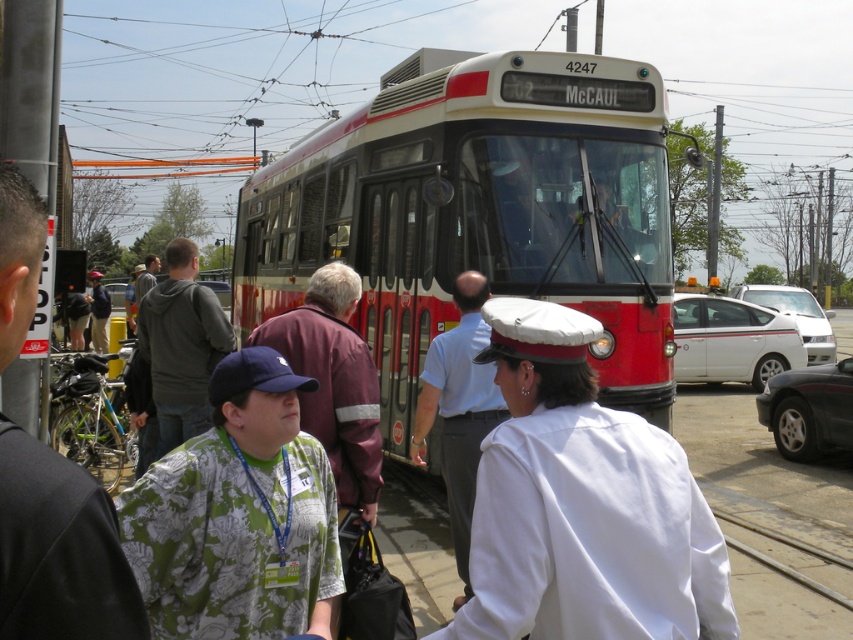
Which is more to the left, white uniform at center or dark gray hoodie at center?

From the viewer's perspective, dark gray hoodie at center appears more on the left side.

Between point (473, 310) and point (200, 401), which one is positioned in front?

Point (473, 310) is in front.

Between point (453, 394) and point (207, 291), which one is positioned behind?

The point (207, 291) is more distant.

In order to click on white uniform at center in this screenshot , I will do `click(459, 410)`.

Who is shorter, red polished metal bus at center or dark gray hoodie at center?

dark gray hoodie at center is shorter.

Which is behind, point (434, 97) or point (178, 291)?

Point (434, 97)

Who is more forward, (595, 234) or (158, 433)?

Point (158, 433) is in front.

Image resolution: width=853 pixels, height=640 pixels. In order to click on red polished metal bus at center in this screenshot , I will do `click(479, 212)`.

Does red polished metal bus at center appear on the left side of white cotton cap at center?

Correct, you'll find red polished metal bus at center to the left of white cotton cap at center.

Consider the image. Is red polished metal bus at center wider than white cotton cap at center?

Correct, the width of red polished metal bus at center exceeds that of white cotton cap at center.

Between point (357, 166) and point (653, 458), which one is positioned in front?

Point (653, 458) is more forward.

This screenshot has width=853, height=640. What are the coordinates of `red polished metal bus at center` in the screenshot? It's located at (479, 212).